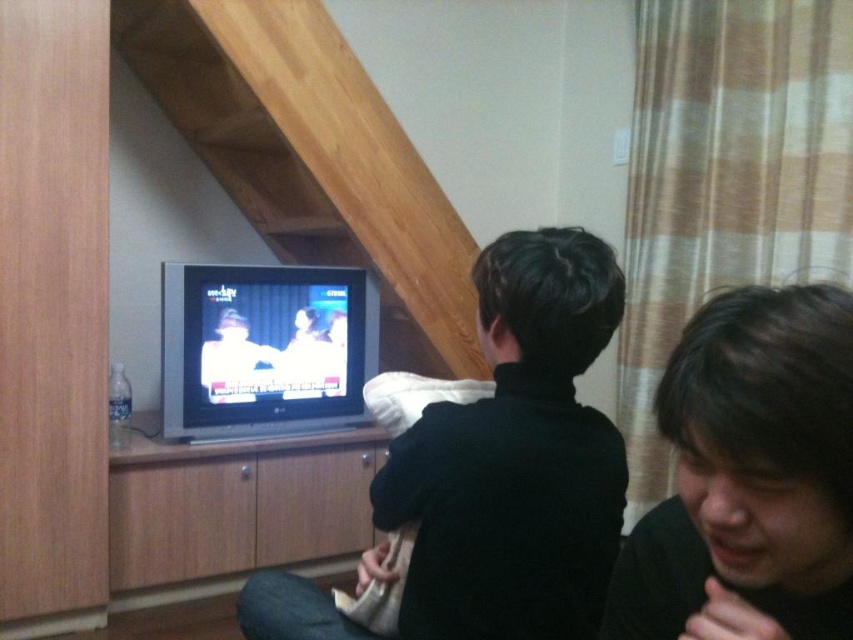
Can you confirm if black matte shirt at center is taller than dark brown hair at lower right?

Yes, black matte shirt at center is taller than dark brown hair at lower right.

Who is taller, black matte shirt at center or dark brown hair at lower right?

black matte shirt at center

Is point (550, 560) positioned behind point (828, 436)?

Yes, it is behind point (828, 436).

The height and width of the screenshot is (640, 853). In order to click on black matte shirt at center in this screenshot , I will do `click(515, 458)`.